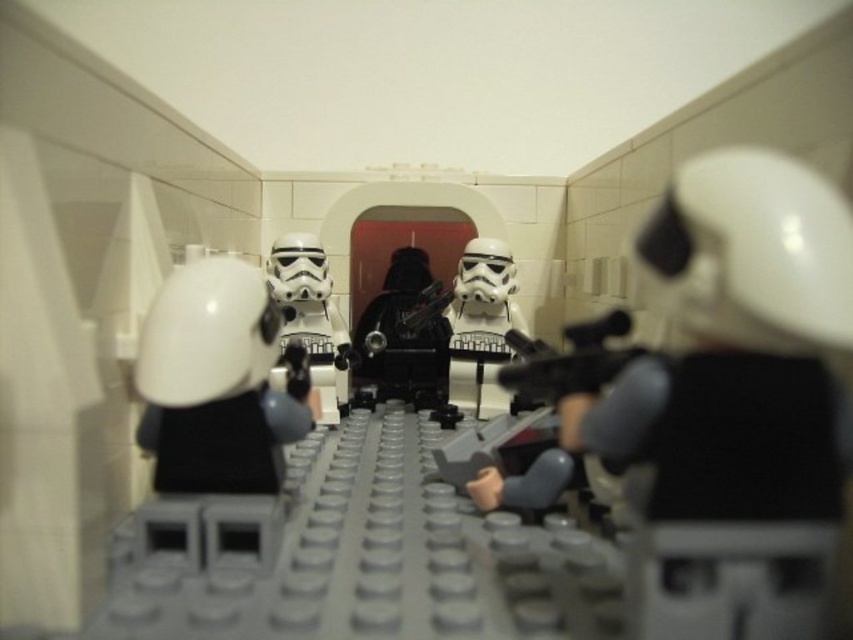
Is white matte helmet at center positioned behind black plastic gun at center?

No, it is not.

Between white matte helmet at center and black plastic gun at center, which one is positioned higher?

Positioned higher is black plastic gun at center.

Where is `white matte helmet at center`? white matte helmet at center is located at coordinates (216, 381).

At what (x,y) coordinates should I click in order to perform the action: click on white matte helmet at center. Please return your answer as a coordinate pair (x, y). The image size is (853, 640). Looking at the image, I should click on (216, 381).

Who is positioned more to the left, white matte helmet at center or matte black gun at center?

white matte helmet at center

Does point (293, 360) lie behind point (543, 381)?

Yes, point (293, 360) is behind point (543, 381).

Where is `white matte helmet at center`? white matte helmet at center is located at coordinates (216, 381).

Between white plastic stormtrooper helmet at center and white plastic stormtrooper at center, which one has less height?

white plastic stormtrooper helmet at center is shorter.

Can you confirm if white plastic stormtrooper helmet at center is bigger than white plastic stormtrooper at center?

No, white plastic stormtrooper helmet at center is not bigger than white plastic stormtrooper at center.

Which is in front, point (488, 268) or point (277, 369)?

Point (277, 369) is more forward.

The height and width of the screenshot is (640, 853). I want to click on white plastic stormtrooper helmet at center, so click(x=480, y=326).